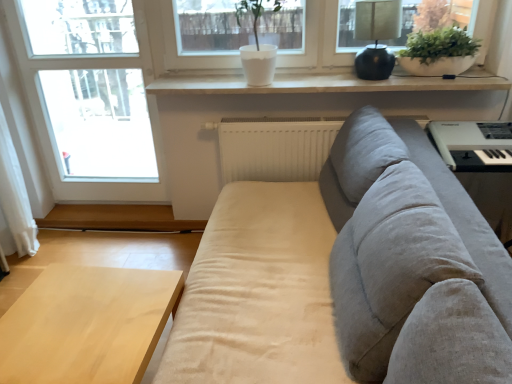
Question: From a real-world perspective, is light wood table at lower left located higher than white matte radiator at center?

Choices:
 (A) no
 (B) yes

Answer: (A)

Question: Is light wood table at lower left directly adjacent to white matte radiator at center?

Choices:
 (A) no
 (B) yes

Answer: (A)

Question: Could white matte radiator at center be considered to be inside light wood table at lower left?

Choices:
 (A) no
 (B) yes

Answer: (A)

Question: From a real-world perspective, is light wood table at lower left below white matte radiator at center?

Choices:
 (A) yes
 (B) no

Answer: (A)

Question: Can you confirm if light wood table at lower left is shorter than white matte radiator at center?

Choices:
 (A) yes
 (B) no

Answer: (A)

Question: Does light wood table at lower left have a greater width compared to white matte radiator at center?

Choices:
 (A) yes
 (B) no

Answer: (A)

Question: Is there a large distance between white matte bowl at upper right and matte black lamp at upper right?

Choices:
 (A) no
 (B) yes

Answer: (A)

Question: From the image's perspective, does white matte bowl at upper right appear lower than matte black lamp at upper right?

Choices:
 (A) no
 (B) yes

Answer: (B)

Question: Does white matte bowl at upper right have a lesser width compared to matte black lamp at upper right?

Choices:
 (A) yes
 (B) no

Answer: (A)

Question: Can you confirm if white matte bowl at upper right is positioned to the right of matte black lamp at upper right?

Choices:
 (A) yes
 (B) no

Answer: (A)

Question: Considering the relative sizes of white matte bowl at upper right and matte black lamp at upper right in the image provided, is white matte bowl at upper right shorter than matte black lamp at upper right?

Choices:
 (A) no
 (B) yes

Answer: (B)

Question: From the image's perspective, is white matte bowl at upper right above matte black lamp at upper right?

Choices:
 (A) no
 (B) yes

Answer: (A)

Question: Does white matte window sill at upper center have a greater width compared to transparent glass window at left?

Choices:
 (A) no
 (B) yes

Answer: (B)